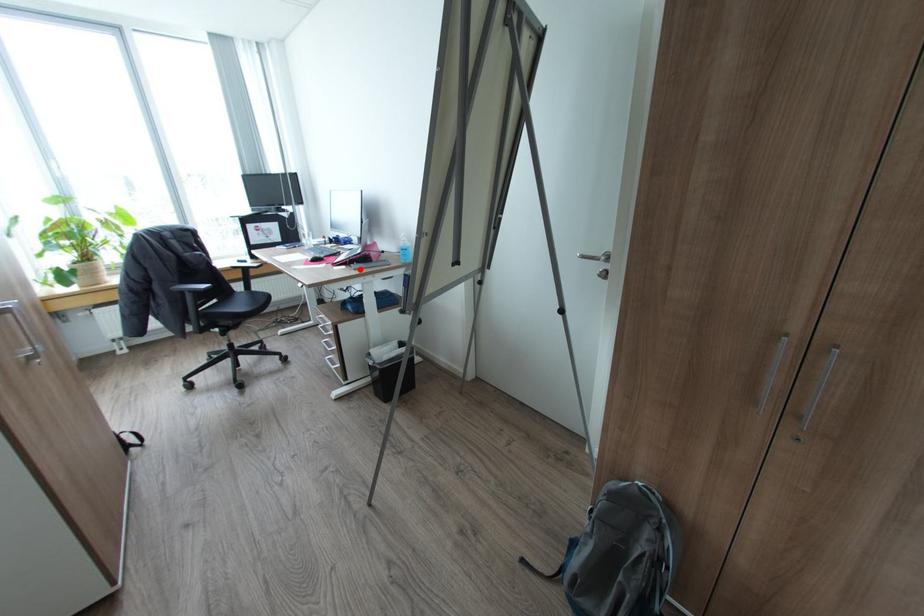
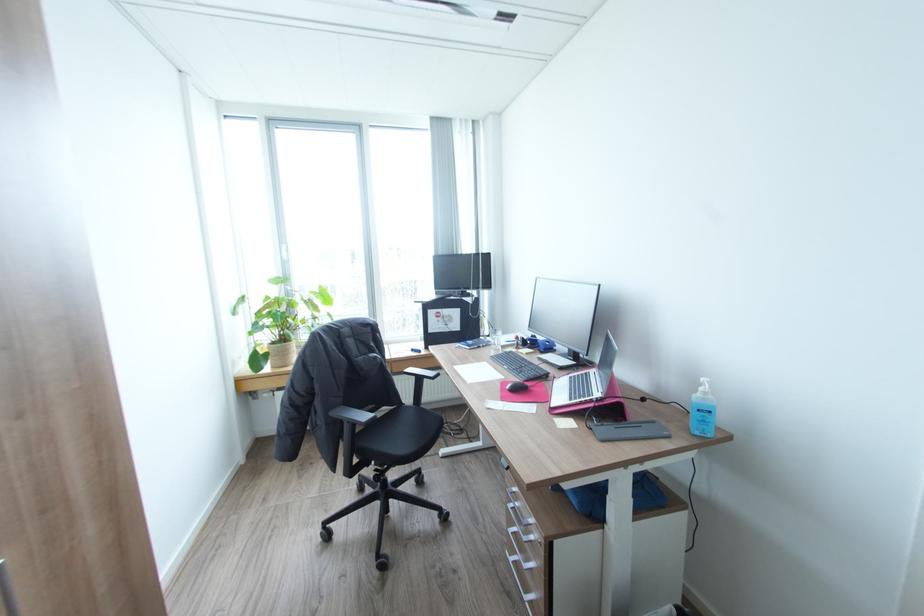
In the second image, find the point that corresponds to the highlighted location in the first image.

(608, 440)